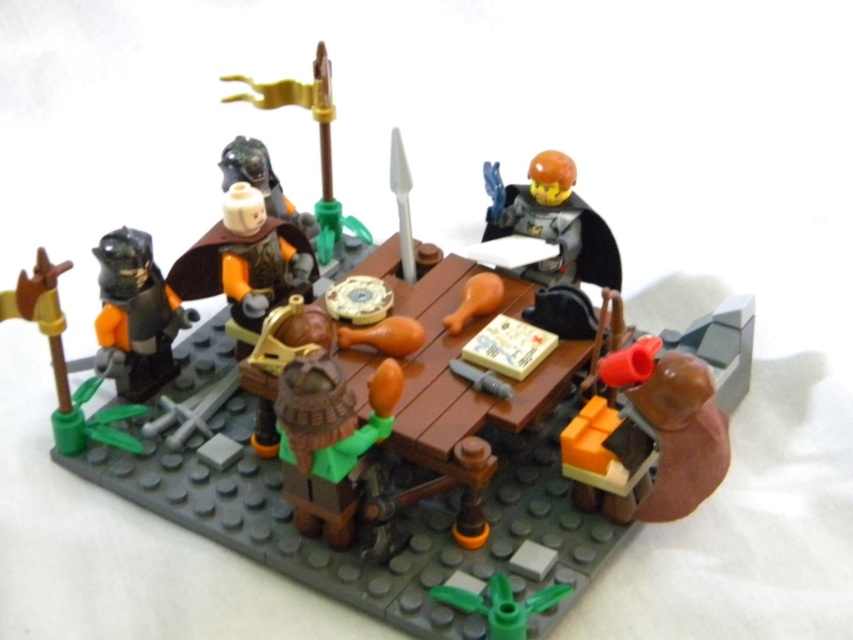
Question: Is brown matte helmet at center below gold metallic flagpole at upper center?

Choices:
 (A) yes
 (B) no

Answer: (A)

Question: Does shiny silver armor at left appear under gold metallic flagpole at upper center?

Choices:
 (A) yes
 (B) no

Answer: (A)

Question: Which point is closer to the camera?

Choices:
 (A) (361, 232)
 (B) (573, 280)
 (C) (283, 467)
 (D) (196, 246)

Answer: (C)

Question: Which point is closer to the camera?

Choices:
 (A) shiny silver armor at left
 (B) smooth orange cape at center

Answer: (A)

Question: Is brown matte helmet at center above metallic silver helmet at upper right?

Choices:
 (A) yes
 (B) no

Answer: (B)

Question: Which point is farther from the camera taking this photo?

Choices:
 (A) (492, 173)
 (B) (151, 346)
 (C) (297, 93)
 (D) (260, 273)

Answer: (C)